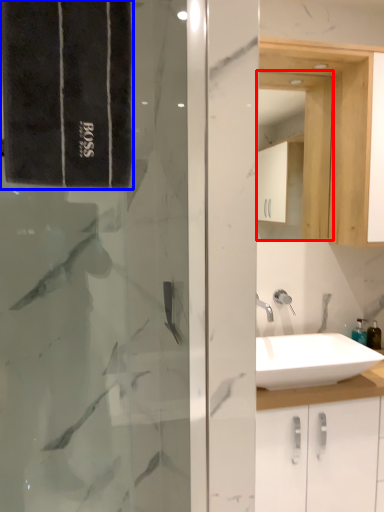
Question: Which of the following is the closest to the observer, medicine cabinet (highlighted by a red box) or bath towel (highlighted by a blue box)?

Choices:
 (A) medicine cabinet
 (B) bath towel

Answer: (B)